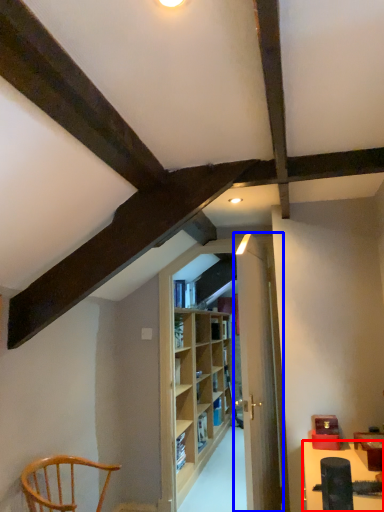
Question: Which object appears farthest to the camera in this image, table (highlighted by a red box) or door (highlighted by a blue box)?

Choices:
 (A) table
 (B) door

Answer: (B)